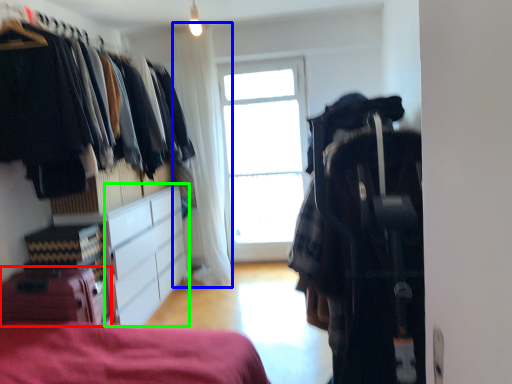
Question: Considering the real-world distances, which object is farthest from luggage (highlighted by a red box)? curtain (highlighted by a blue box) or cabinetry (highlighted by a green box)?

Choices:
 (A) curtain
 (B) cabinetry

Answer: (A)